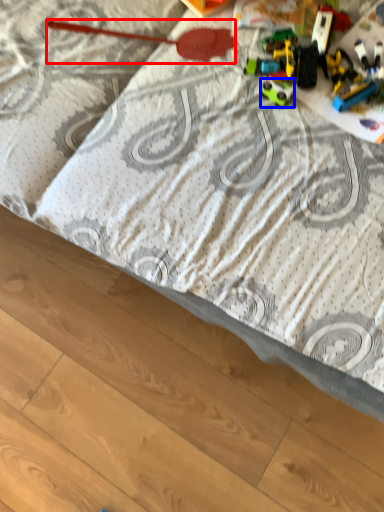
Question: Which object appears closest to the camera in this image, toy (highlighted by a red box) or toy (highlighted by a blue box)?

Choices:
 (A) toy
 (B) toy

Answer: (B)